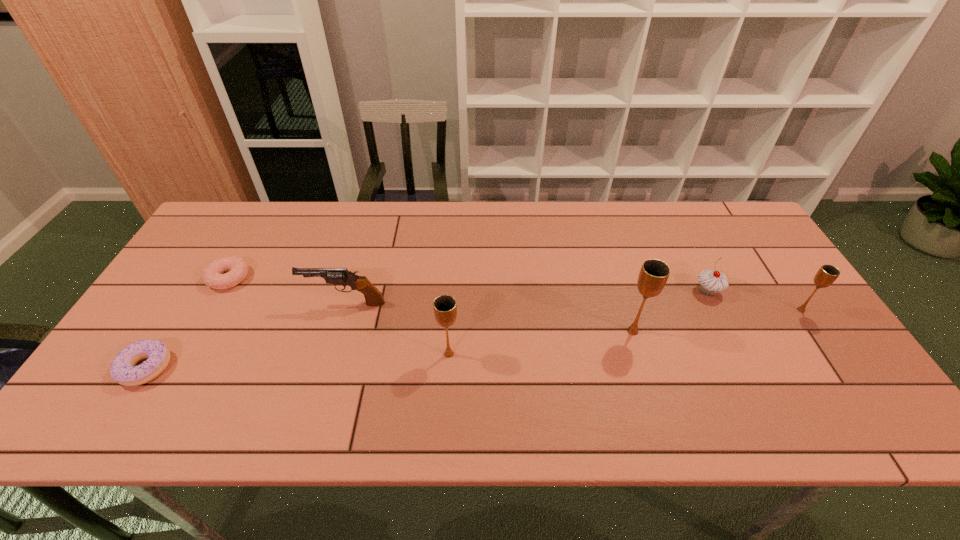
In the current image, all chalices are evenly spaced. To maintain this equal spacing, where should an additional chalice be placed on the left? Please point out a free spot. Please provide its 2D coordinates. Your answer should be formatted as a tuple, i.e. [(x, y)], where the tuple contains the x and y coordinates of a point satisfying the conditions above.

[(248, 379)]